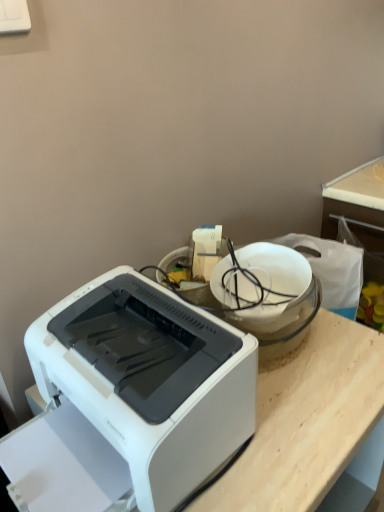
Question: Is white glossy bowl at upper center not inside white plastic printer at lower left?

Choices:
 (A) yes
 (B) no

Answer: (A)

Question: Can you confirm if white glossy bowl at upper center is shorter than white plastic printer at lower left?

Choices:
 (A) no
 (B) yes

Answer: (B)

Question: From the image's perspective, is white glossy bowl at upper center beneath white plastic printer at lower left?

Choices:
 (A) no
 (B) yes

Answer: (A)

Question: Is white glossy bowl at upper center oriented towards white plastic printer at lower left?

Choices:
 (A) no
 (B) yes

Answer: (B)

Question: Is white glossy bowl at upper center not near white plastic printer at lower left?

Choices:
 (A) yes
 (B) no

Answer: (B)

Question: Considering the relative sizes of white glossy bowl at upper center and white plastic printer at lower left in the image provided, is white glossy bowl at upper center wider than white plastic printer at lower left?

Choices:
 (A) yes
 (B) no

Answer: (B)

Question: Does white plastic printer at lower left have a larger size compared to white glossy bowl at upper center?

Choices:
 (A) yes
 (B) no

Answer: (A)

Question: Is white plastic printer at lower left at the right side of white glossy bowl at upper center?

Choices:
 (A) yes
 (B) no

Answer: (B)

Question: Is white plastic printer at lower left at the left side of white glossy bowl at upper center?

Choices:
 (A) no
 (B) yes

Answer: (B)

Question: Is white plastic printer at lower left facing away from white glossy bowl at upper center?

Choices:
 (A) no
 (B) yes

Answer: (B)

Question: From the image's perspective, is white plastic printer at lower left located beneath white glossy bowl at upper center?

Choices:
 (A) yes
 (B) no

Answer: (A)

Question: Can you confirm if white plastic printer at lower left is smaller than white glossy bowl at upper center?

Choices:
 (A) no
 (B) yes

Answer: (A)

Question: From a real-world perspective, is white plastic printer at lower left above or below white glossy bowl at upper center?

Choices:
 (A) below
 (B) above

Answer: (A)